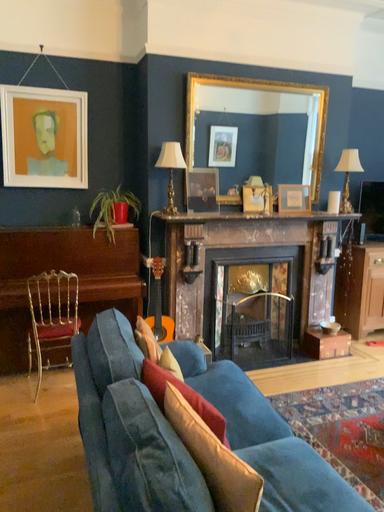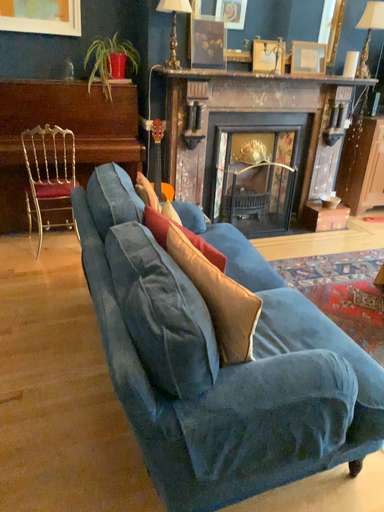
Question: How did the camera likely rotate when shooting the video?

Choices:
 (A) rotated downward
 (B) rotated upward

Answer: (A)